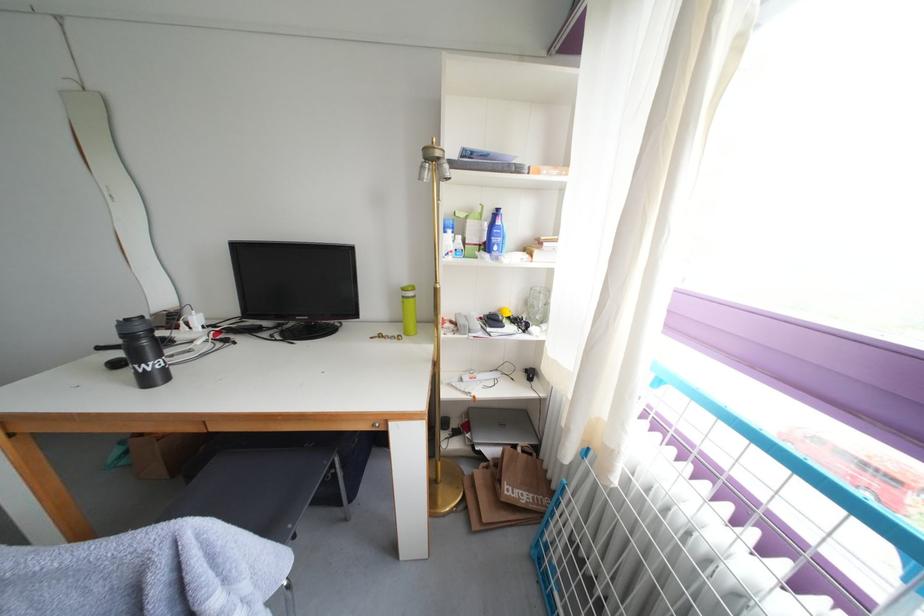
This screenshot has width=924, height=616. I want to click on brown paper bag, so click(x=506, y=490).